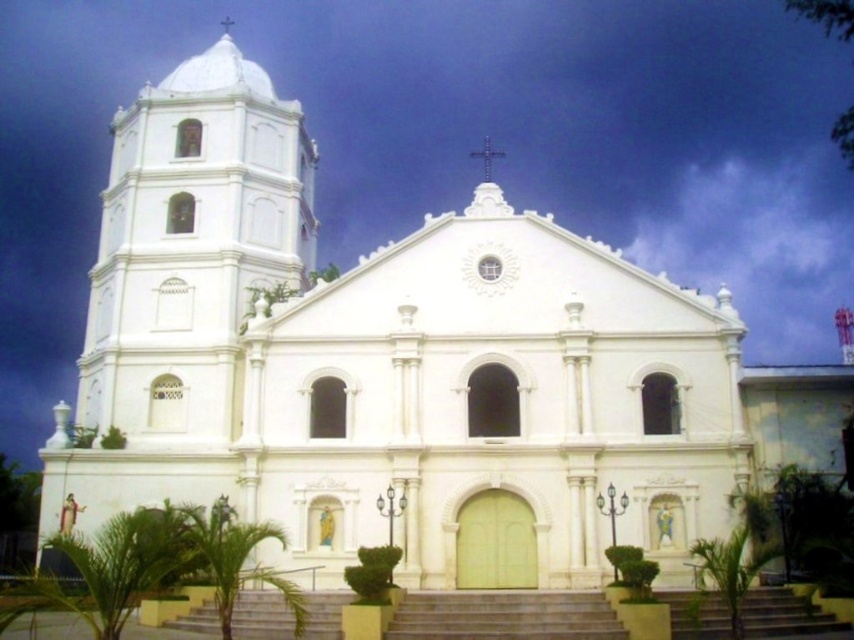
Is white smooth tower at left in front of white stone cross at upper center?

That is False.

Does point (256, 211) come farther from viewer compared to point (500, 154)?

No, (256, 211) is in front of (500, 154).

Between point (188, 212) and point (489, 173), which one is positioned behind?

Point (489, 173)

Find the location of a particular element. white smooth tower at left is located at coordinates (192, 244).

You are a GUI agent. You are given a task and a screenshot of the screen. Output one action in this format:
    pyautogui.click(x=<x>, y=<y>)
    Task: Click on the white smooth tower at left
    The height and width of the screenshot is (640, 854).
    Given the screenshot: What is the action you would take?
    pyautogui.click(x=192, y=244)

Can you confirm if white smooth tower at left is shorter than smooth concrete stairs at center?

No.

Is point (247, 272) more distant than point (427, 632)?

Yes, point (247, 272) is behind point (427, 632).

The width and height of the screenshot is (854, 640). In order to click on white smooth tower at left in this screenshot , I will do `click(192, 244)`.

Where is `smooth concrete stairs at center`? The width and height of the screenshot is (854, 640). smooth concrete stairs at center is located at coordinates (506, 616).

Looking at this image, who is shorter, smooth concrete stairs at center or white stone cross at upper center?

With less height is smooth concrete stairs at center.

Does point (604, 600) lie in front of point (481, 152)?

That is True.

Locate an element on the screen. smooth concrete stairs at center is located at coordinates (506, 616).